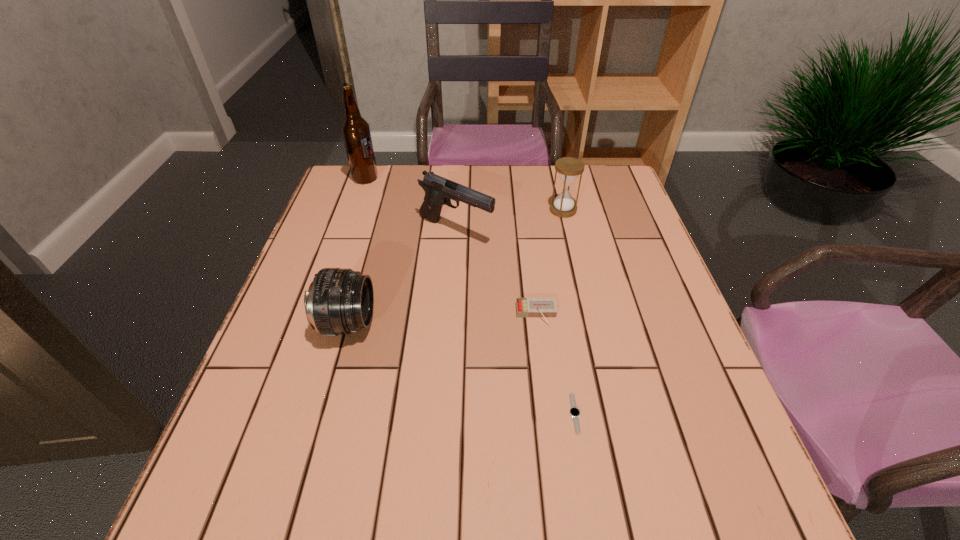
This screenshot has height=540, width=960. What are the coordinates of `vacant area situated 0.310m on the left of the hourglass` in the screenshot? It's located at (442, 210).

Find the location of a particular element. free space located at the front element of the telephoto lens is located at coordinates (423, 323).

What are the coordinates of `vacant point located 0.270m on the striking surface of the matchbox` in the screenshot? It's located at 553,450.

Identify the location of free space located 0.320m on the left of the shortest object. (394, 413).

Identify the location of beer bottle positioned at the far edge. (356, 133).

This screenshot has width=960, height=540. In order to click on hourglass positioned at the far edge in this screenshot , I will do `click(568, 168)`.

Find the location of a particular element. beer bottle situated at the left edge is located at coordinates (356, 133).

Image resolution: width=960 pixels, height=540 pixels. I want to click on telephoto lens located at the left edge, so click(339, 301).

Where is `object that is positioned at the far left corner`? The height and width of the screenshot is (540, 960). object that is positioned at the far left corner is located at coordinates (356, 133).

Locate an element on the screen. This screenshot has height=540, width=960. free space at the far edge is located at coordinates (447, 171).